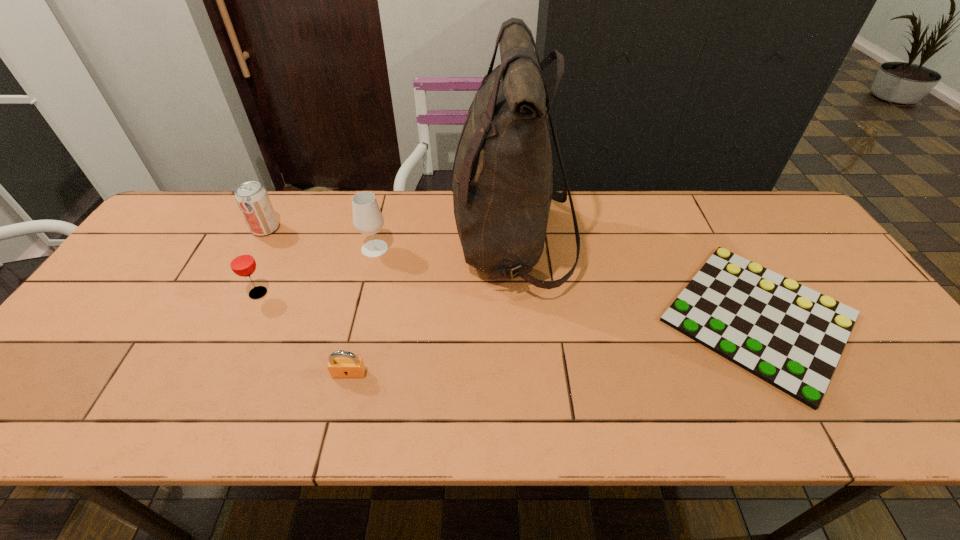
Where is `the tallest object`? The width and height of the screenshot is (960, 540). the tallest object is located at coordinates (502, 189).

Find the location of a particular element. The width and height of the screenshot is (960, 540). backpack is located at coordinates (502, 189).

This screenshot has width=960, height=540. Find the location of `the right glass`. the right glass is located at coordinates 367,217.

At what (x,y) coordinates should I click in order to perform the action: click on the taller glass. Please return your answer as a coordinate pair (x, y). Image resolution: width=960 pixels, height=540 pixels. Looking at the image, I should click on (367, 217).

Where is `soda can`? The height and width of the screenshot is (540, 960). soda can is located at coordinates (252, 198).

This screenshot has width=960, height=540. I want to click on the nearer glass, so click(242, 263).

Locate an element on the screen. Image resolution: width=960 pixels, height=540 pixels. the shorter glass is located at coordinates (242, 263).

The image size is (960, 540). Find the location of `the second shortest object`. the second shortest object is located at coordinates (352, 367).

Find the location of a particular element. the shortest object is located at coordinates (790, 336).

Image resolution: width=960 pixels, height=540 pixels. I want to click on the rightmost object, so [790, 336].